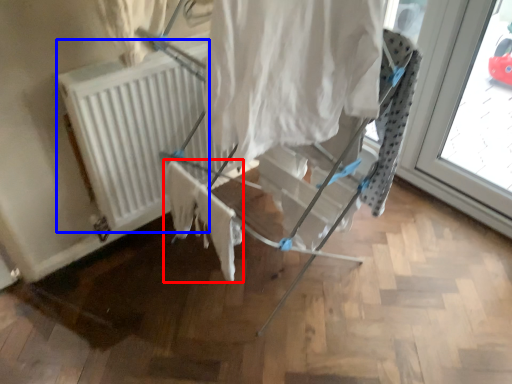
Question: Which object is closer to the camera taking this photo, fabric (highlighted by a red box) or radiator (highlighted by a blue box)?

Choices:
 (A) fabric
 (B) radiator

Answer: (A)